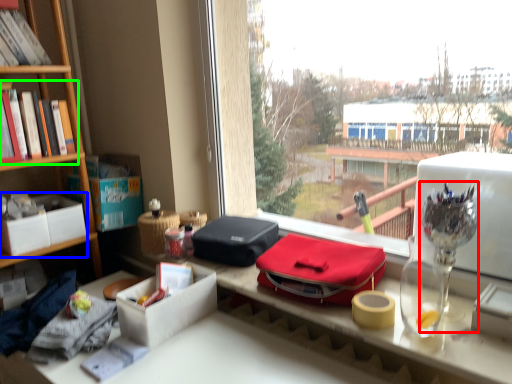
Question: Which object is the closest to the glass vase (highlighted by a red box)? Choose among these: box (highlighted by a blue box) or book (highlighted by a green box).

Choices:
 (A) box
 (B) book

Answer: (B)